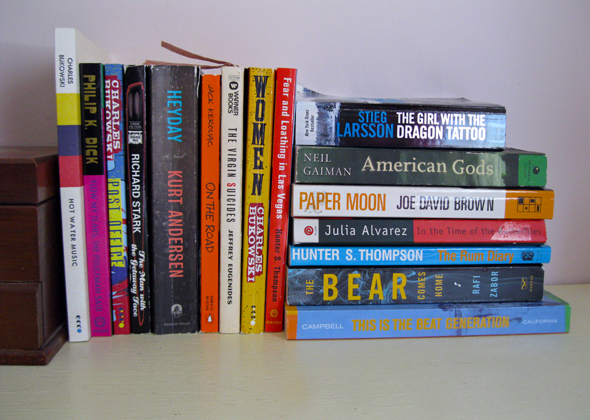
The width and height of the screenshot is (590, 420). What are the coordinates of `book stacked horizontally` in the screenshot? It's located at (415, 323), (412, 278), (405, 256), (417, 231), (408, 200), (409, 168), (389, 116).